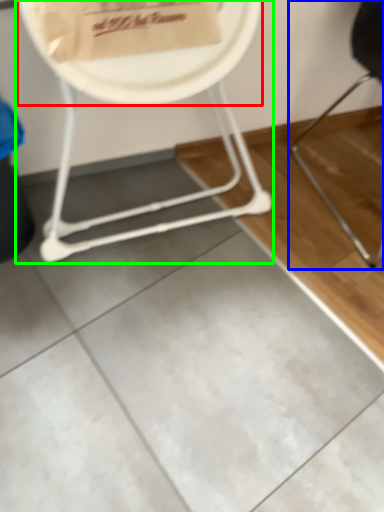
Question: Considering the real-world distances, which object is closest to paper plate (highlighted by a red box)? chair (highlighted by a blue box) or chair (highlighted by a green box).

Choices:
 (A) chair
 (B) chair

Answer: (B)